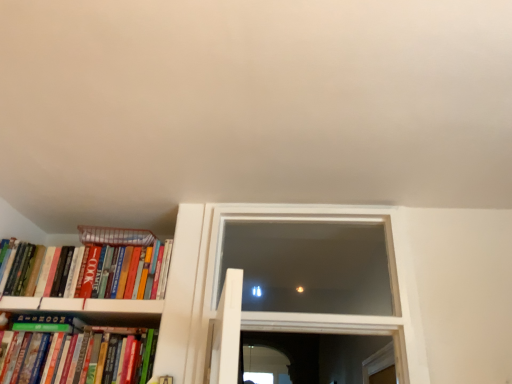
Question: Considering the positions of point (141, 284) and point (153, 233), is point (141, 284) closer or farther from the camera than point (153, 233)?

Choices:
 (A) closer
 (B) farther

Answer: (A)

Question: Considering their positions, is hardcover books at left, acting as the second book starting from the bottom, located in front of or behind striped paper at left?

Choices:
 (A) front
 (B) behind

Answer: (A)

Question: Based on their relative distances, which object is farther from the green matte bookshelf at lower left, arranged as the 1th book when ordered from the bottom?

Choices:
 (A) striped paper at left
 (B) transparent glass window at center
 (C) hardcover books at left, positioned as the 1th book in top-to-bottom order

Answer: (B)

Question: Which object is the farthest from the transparent glass window at center?

Choices:
 (A) striped paper at left
 (B) hardcover books at left, positioned as the 1th book in top-to-bottom order
 (C) green matte bookshelf at lower left, marked as the second book in a top-to-bottom arrangement

Answer: (A)